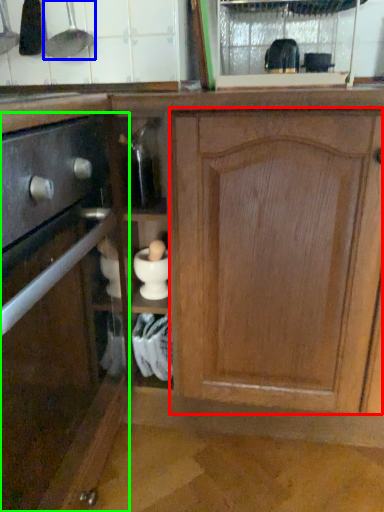
Question: Estimate the real-world distances between objects in this image. Which object is closer to cabinetry (highlighted by a red box), appliance (highlighted by a blue box) or cabinetry (highlighted by a green box)?

Choices:
 (A) appliance
 (B) cabinetry

Answer: (B)